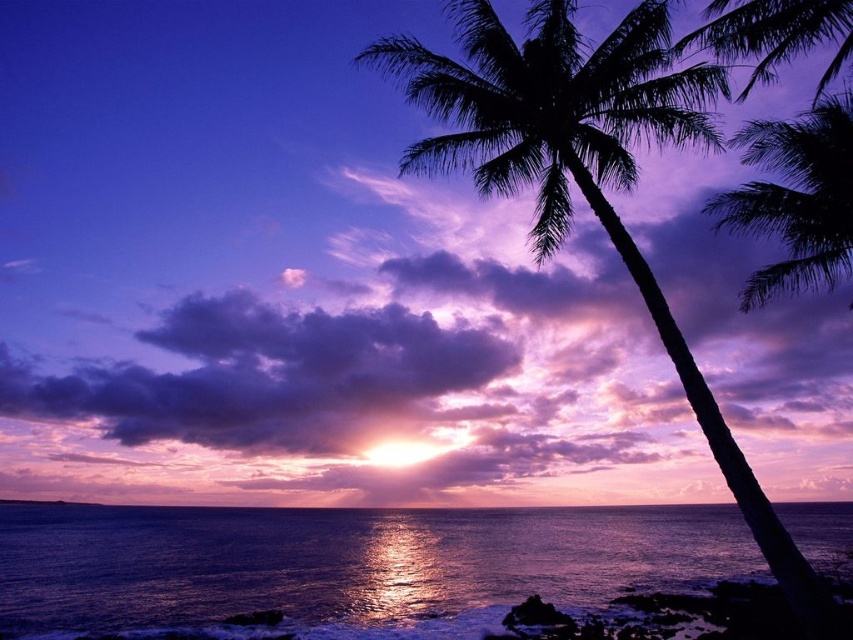
You are a photographer trying to capture the sunset. You notice two palm trees in the scene. Which one, the silhouette palm tree at right or the silhouette leafy palm at upper right, appears closer to the camera based on their positions?

The silhouette palm tree at right appears closer to the camera because it is positioned over the silhouette leafy palm at upper right, indicating it is in front.

You are a photographer trying to capture the sunset scene. You notice two palm trees in the foreground. Which palm tree, the silhouette palm tree at right or the silhouette leafy palm at upper right, appears smaller in the photo?

The silhouette palm tree at right appears smaller in the photo compared to the silhouette leafy palm at upper right.